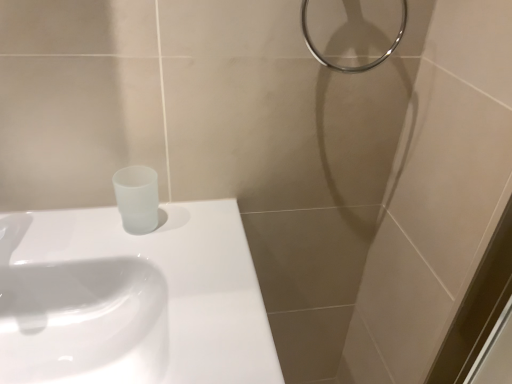
At what (x,y) coordinates should I click in order to perform the action: click on blank space situated above white glossy sink at lower left, marked as the first sink in a top-to-bottom arrangement (from a real-world perspective). Please return your answer as a coordinate pair (x, y). Looking at the image, I should click on (128, 252).